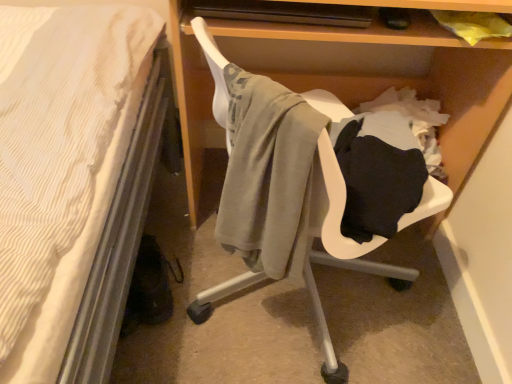
You are a GUI agent. You are given a task and a screenshot of the screen. Output one action in this format:
    pyautogui.click(x=<x>, y=<y>)
    Task: Click on the matte gray swivel chair at center
    The width and height of the screenshot is (512, 384).
    Given the screenshot: What is the action you would take?
    pyautogui.click(x=310, y=186)

This screenshot has width=512, height=384. Describe the element at coordinates (310, 186) in the screenshot. I see `matte gray swivel chair at center` at that location.

Measure the distance between matte gray swivel chair at center and camera.

matte gray swivel chair at center and camera are 21.89 inches apart.

In order to face wooden shelf at center, should I rotate leftwards or rightwards?

Turn right approximately 9.746 degrees to face it.

Image resolution: width=512 pixels, height=384 pixels. I want to click on wooden shelf at center, so click(390, 67).

Measure the distance between wooden shelf at center and camera.

The distance of wooden shelf at center from camera is 30.97 inches.

The width and height of the screenshot is (512, 384). Describe the element at coordinates (390, 67) in the screenshot. I see `wooden shelf at center` at that location.

The width and height of the screenshot is (512, 384). I want to click on matte gray swivel chair at center, so click(310, 186).

In the image, is matte gray swivel chair at center on the left side or the right side of wooden shelf at center?

matte gray swivel chair at center is to the left of wooden shelf at center.

Which object is further away from the camera taking this photo, matte gray swivel chair at center or wooden shelf at center?

wooden shelf at center is further away from the camera.

Does point (411, 189) come in front of point (228, 56)?

Yes, point (411, 189) is closer to viewer.

From the image's perspective, between matte gray swivel chair at center and wooden shelf at center, which one is located above?

wooden shelf at center is shown above in the image.

From a real-world perspective, is matte gray swivel chair at center over wooden shelf at center?

Yes, from a real-world perspective, matte gray swivel chair at center is over wooden shelf at center

Looking at this image, looking at their sizes, would you say matte gray swivel chair at center is wider or thinner than wooden shelf at center?

Clearly, matte gray swivel chair at center has less width compared to wooden shelf at center.

Is matte gray swivel chair at center taller than wooden shelf at center?

Incorrect, the height of matte gray swivel chair at center is not larger of that of wooden shelf at center.

In the scene shown: Is matte gray swivel chair at center bigger than wooden shelf at center?

Actually, matte gray swivel chair at center might be smaller than wooden shelf at center.

Is matte gray swivel chair at center located outside wooden shelf at center?

matte gray swivel chair at center lies outside wooden shelf at center's area.

Is matte gray swivel chair at center next to wooden shelf at center and touching it?

No, matte gray swivel chair at center is not touching wooden shelf at center.

Is matte gray swivel chair at center facing towards wooden shelf at center?

Yes, matte gray swivel chair at center is facing wooden shelf at center.

Where is `shelf that is above the matte gray swivel chair at center (from the image's perspective)`? This screenshot has height=384, width=512. shelf that is above the matte gray swivel chair at center (from the image's perspective) is located at coordinates (390, 67).

Considering the relative positions of wooden shelf at center and matte gray swivel chair at center in the image provided, is wooden shelf at center to the right of matte gray swivel chair at center from the viewer's perspective?

Yes, wooden shelf at center is to the right of matte gray swivel chair at center.

Is wooden shelf at center behind matte gray swivel chair at center?

Yes, it is behind matte gray swivel chair at center.

Does point (504, 106) appear closer or farther from the camera than point (441, 187)?

Point (504, 106) appears to be farther away from the viewer than point (441, 187).

From the image's perspective, relative to matte gray swivel chair at center, is wooden shelf at center above or below?

From the image's perspective, wooden shelf at center appears above matte gray swivel chair at center.

From a real-world perspective, is wooden shelf at center physically located above or below matte gray swivel chair at center?

wooden shelf at center is situated lower than matte gray swivel chair at center in the real world.

Does wooden shelf at center have a lesser width compared to matte gray swivel chair at center?

Incorrect, the width of wooden shelf at center is not less than that of matte gray swivel chair at center.

Is wooden shelf at center shorter than matte gray swivel chair at center?

In fact, wooden shelf at center may be taller than matte gray swivel chair at center.

Is wooden shelf at center smaller than matte gray swivel chair at center?

No, wooden shelf at center is not smaller than matte gray swivel chair at center.

Could matte gray swivel chair at center be considered to be inside wooden shelf at center?

No, matte gray swivel chair at center is not surrounded by wooden shelf at center.

Is the surface of wooden shelf at center in direct contact with matte gray swivel chair at center?

No.

Is wooden shelf at center aimed at matte gray swivel chair at center?

Yes.

How different are the orientations of wooden shelf at center and matte gray swivel chair at center in degrees?

There is a 138-degree angle between the facing directions of wooden shelf at center and matte gray swivel chair at center.

Measure the distance from wooden shelf at center to matte gray swivel chair at center.

A distance of 32.48 centimeters exists between wooden shelf at center and matte gray swivel chair at center.

Where is `swivel chair in front of the wooden shelf at center`? swivel chair in front of the wooden shelf at center is located at coordinates (310, 186).

Image resolution: width=512 pixels, height=384 pixels. Identify the location of swivel chair in front of the wooden shelf at center. (x=310, y=186).

The height and width of the screenshot is (384, 512). What are the coordinates of `shelf that appears behind the matte gray swivel chair at center` in the screenshot? It's located at (390, 67).